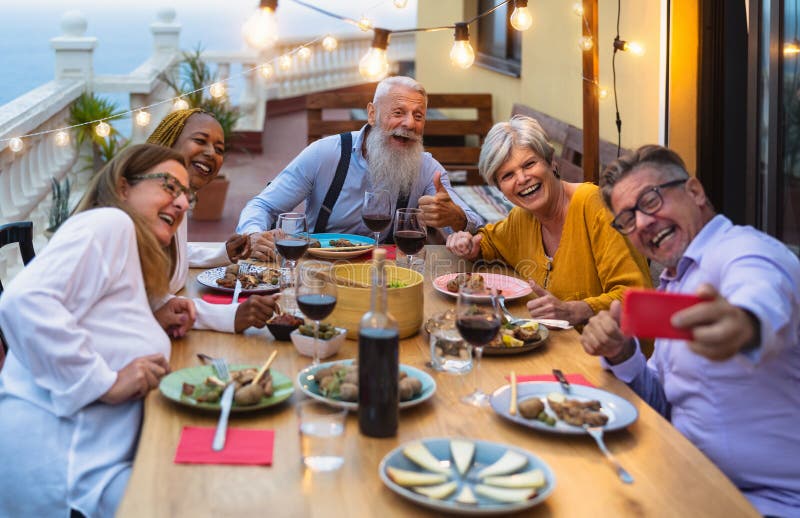
The height and width of the screenshot is (518, 800). Identify the location of plates. (274, 398), (434, 390), (421, 496), (502, 400), (524, 291), (212, 282), (342, 246).